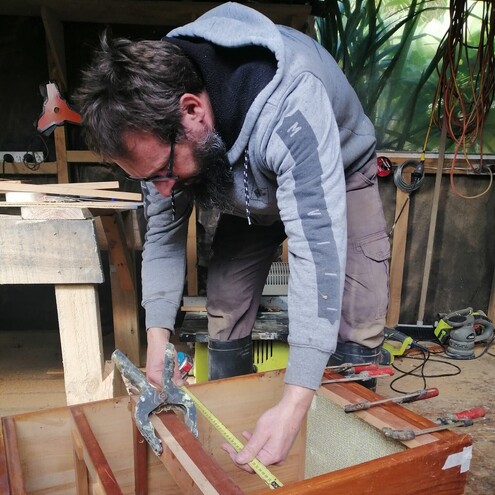
Identify the location of wood table. tap(47, 259).